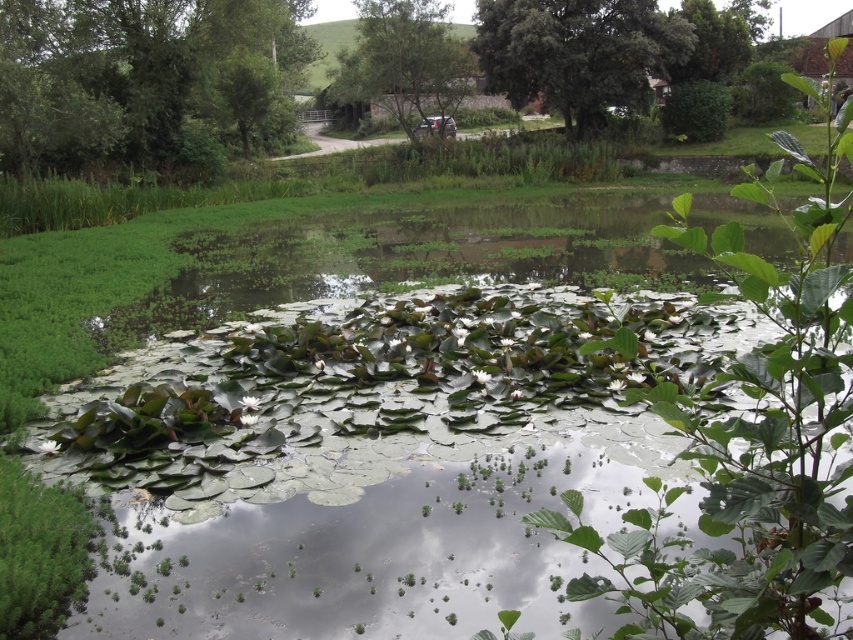
I want to click on green leafy tree at upper left, so click(148, 81).

Consider the image. Is green leafy tree at upper right shorter than green leafy tree at center?

Correct, green leafy tree at upper right is not as tall as green leafy tree at center.

Does green leafy tree at upper right have a lesser width compared to green leafy tree at center?

Yes.

Image resolution: width=853 pixels, height=640 pixels. Describe the element at coordinates (577, 52) in the screenshot. I see `green leafy tree at upper right` at that location.

Locate an element on the screen. Image resolution: width=853 pixels, height=640 pixels. green leafy tree at upper right is located at coordinates (577, 52).

Is green leafy tree at upper left bigger than green leafy tree at center?

Yes.

Does green leafy tree at upper left come in front of green leafy tree at center?

Yes, it is.

Who is more forward, (13, 35) or (376, 81)?

Point (13, 35) is more forward.

The height and width of the screenshot is (640, 853). I want to click on green leafy tree at upper left, so click(x=148, y=81).